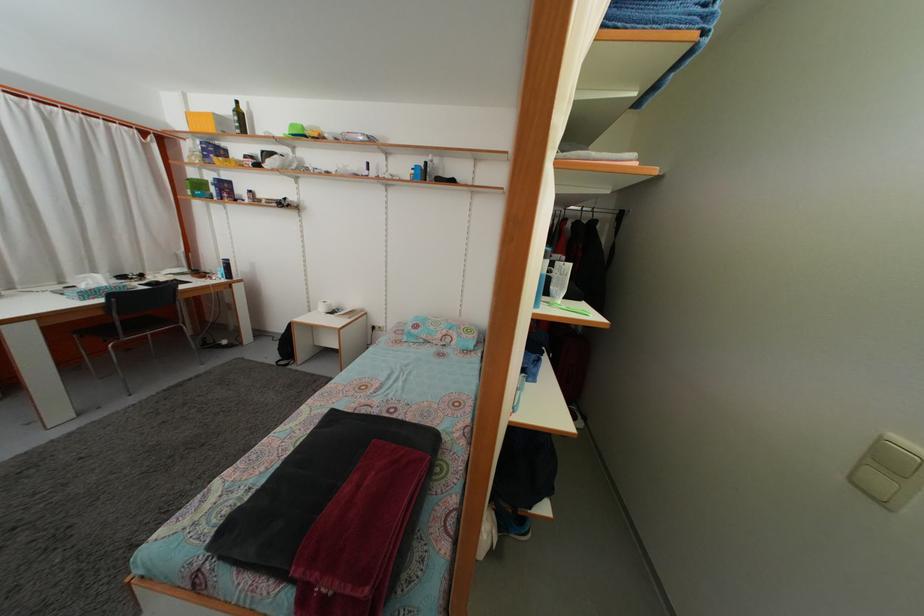
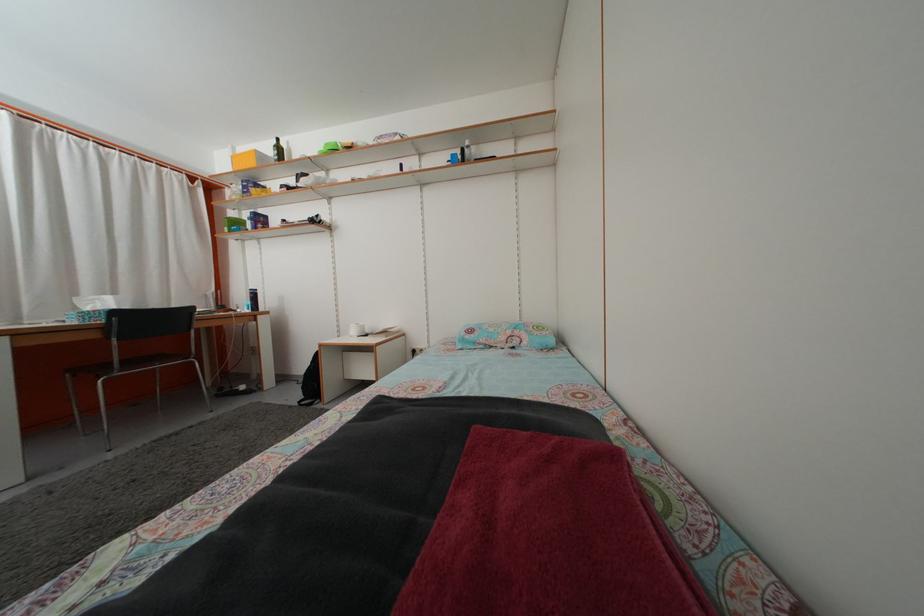
The point at (189, 102) is marked in the first image. Where is the corresponding point in the second image?

(239, 156)